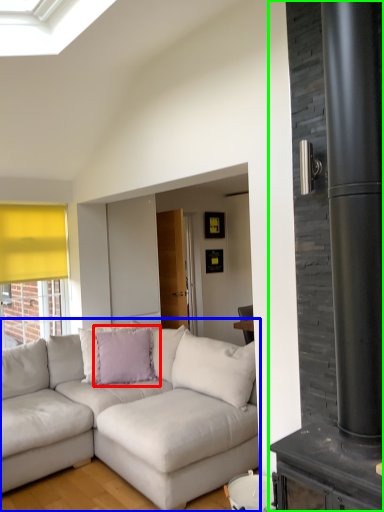
Question: Which is farther away from pillow (highlighted by a red box)? studio couch (highlighted by a blue box) or fireplace (highlighted by a green box)?

Choices:
 (A) studio couch
 (B) fireplace

Answer: (B)